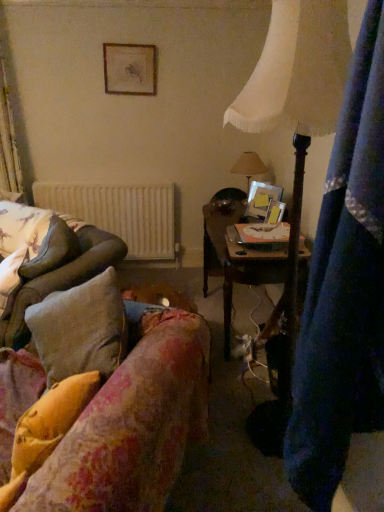
Question: Looking at their shapes, would you say wooden picture frame at center, which is the 1th picture frame from front to back, is wider or thinner than fluffy beige pillow at left, which is the first pillow from top to bottom?

Choices:
 (A) thin
 (B) wide

Answer: (A)

Question: Is wooden picture frame at center, positioned as the third picture frame in top-to-bottom order, to the left or to the right of fluffy beige pillow at left, which is counted as the second pillow, starting from the right, in the image?

Choices:
 (A) left
 (B) right

Answer: (B)

Question: Considering the real-world distances, which object is closest to the white fabric lampshade at upper right?

Choices:
 (A) wooden desk at center
 (B) fluffy yellow pillow at lower left, which appears as the first pillow when viewed from the front
 (C) fluffy fabric couch at lower left
 (D) metallic silver picture frame at upper right, the 2th picture frame from the front
 (E) wooden picture frame at center, arranged as the 3th picture frame when viewed from the left

Answer: (A)

Question: Which of these objects is positioned closest to the fluffy beige pillow at left, the 2th pillow positioned from the bottom?

Choices:
 (A) beige fabric lampshade at upper center
 (B) white matte radiator at upper left
 (C) wooden picture frame at upper center, the third picture frame from the front
 (D) wooden picture frame at center, placed as the 1th picture frame when sorted from right to left
 (E) fluffy fabric couch at lower left

Answer: (E)